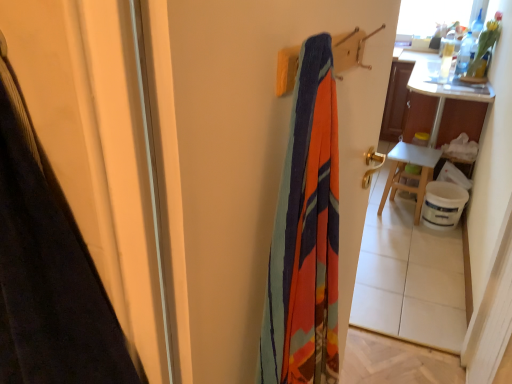
Question: From the image's perspective, is textured fabric screen door at center under white wooden table at right?

Choices:
 (A) yes
 (B) no

Answer: (A)

Question: Is textured fabric screen door at center far away from white wooden table at right?

Choices:
 (A) yes
 (B) no

Answer: (A)

Question: From a real-world perspective, is textured fabric screen door at center beneath white wooden table at right?

Choices:
 (A) no
 (B) yes

Answer: (A)

Question: Is textured fabric screen door at center completely or partially outside of white wooden table at right?

Choices:
 (A) no
 (B) yes

Answer: (B)

Question: Is textured fabric screen door at center wider than white wooden table at right?

Choices:
 (A) yes
 (B) no

Answer: (B)

Question: Does textured fabric screen door at center lie in front of white wooden table at right?

Choices:
 (A) no
 (B) yes

Answer: (B)

Question: Is white wooden table at right oriented towards white wooden table at right?

Choices:
 (A) yes
 (B) no

Answer: (B)

Question: Is white wooden table at right shorter than white wooden table at right?

Choices:
 (A) no
 (B) yes

Answer: (A)

Question: Is white wooden table at right directly adjacent to white wooden table at right?

Choices:
 (A) no
 (B) yes

Answer: (B)

Question: Is white wooden table at right at the left side of white wooden table at right?

Choices:
 (A) yes
 (B) no

Answer: (B)

Question: Is white wooden table at right not close to white wooden table at right?

Choices:
 (A) yes
 (B) no

Answer: (B)

Question: Considering the relative sizes of white wooden table at right and white wooden table at right in the image provided, is white wooden table at right bigger than white wooden table at right?

Choices:
 (A) no
 (B) yes

Answer: (B)

Question: Is white wooden table at right far away from textured fabric screen door at center?

Choices:
 (A) yes
 (B) no

Answer: (A)